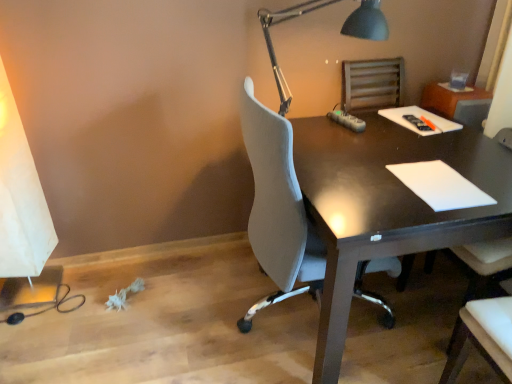
You are a GUI agent. You are given a task and a screenshot of the screen. Output one action in this format:
    pyautogui.click(x=<x>, y=<y>)
    Task: Click on the vacant space positioned to the left of dark wood desk at center
    This screenshot has width=512, height=384.
    Given the screenshot: What is the action you would take?
    [x=175, y=308]